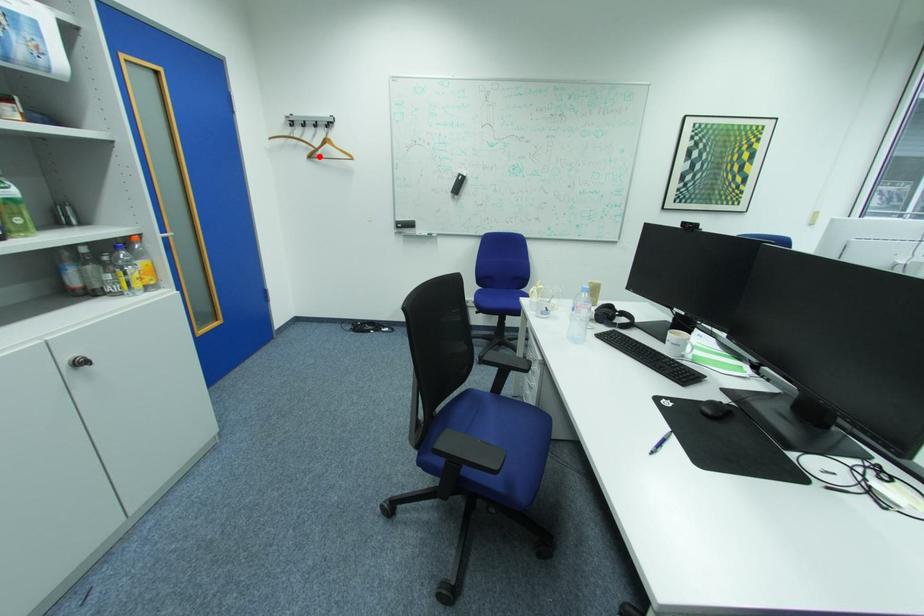
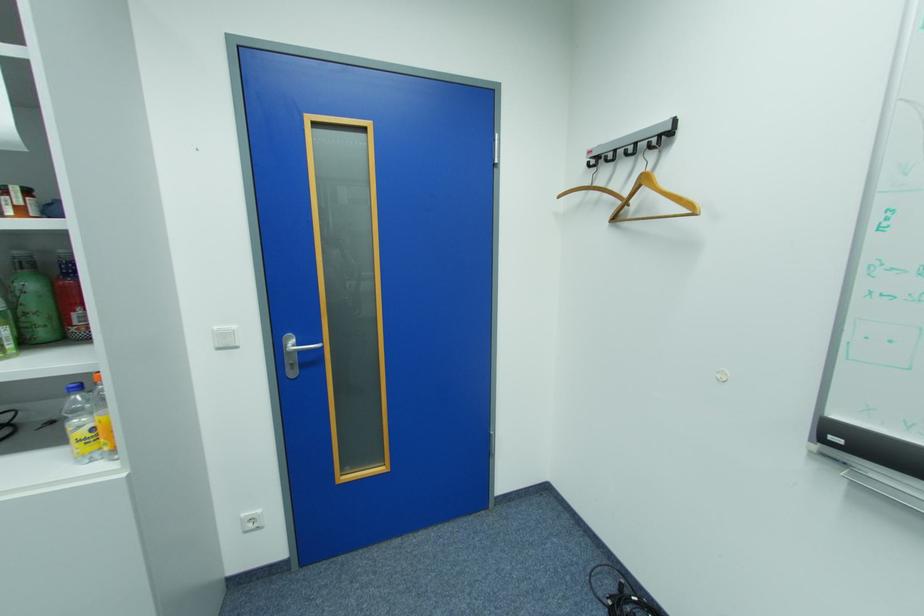
Where in the second image is the point corresponding to the highlighted location from the first image?

(624, 220)